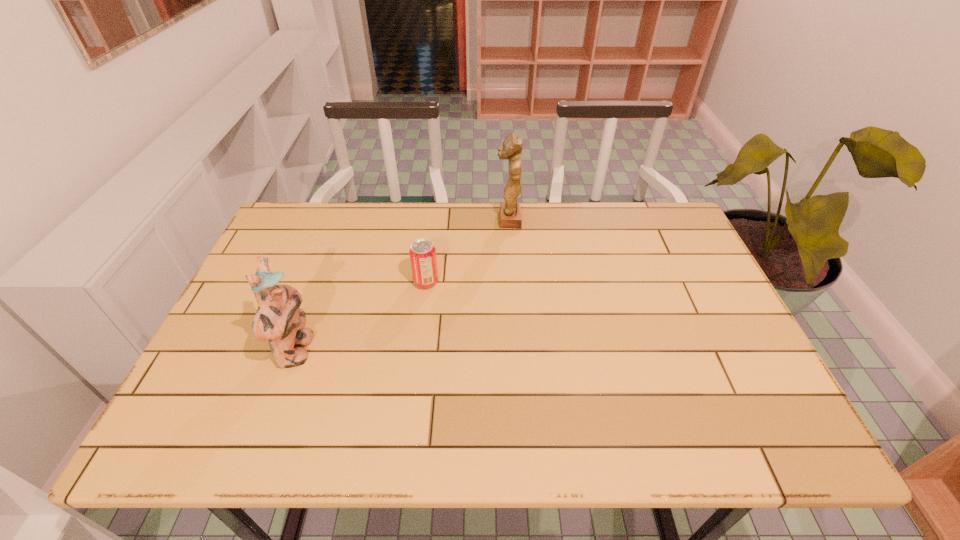
Image resolution: width=960 pixels, height=540 pixels. I want to click on blank area in the image that satisfies the following two spatial constraints: 1. on the front-facing side of the rightmost object; 2. on the front side of the second nearest object, so click(513, 282).

At what (x,y) coordinates should I click in order to perform the action: click on free region that satisfies the following two spatial constraints: 1. on the front side of the second nearest object; 2. on the front-facing side of the leftmost object. Please return your answer as a coordinate pair (x, y). Looking at the image, I should click on [x=418, y=352].